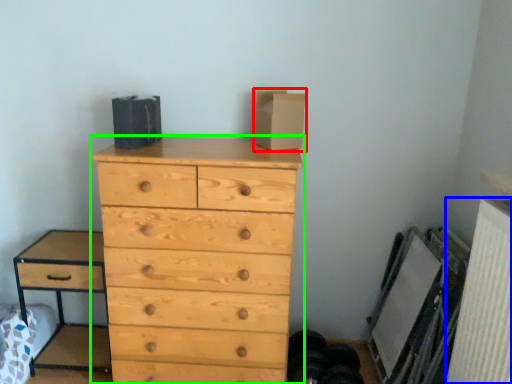
Question: Which object is the farthest from cardboard box (highlighted by a red box)? Choose among these: radiator (highlighted by a blue box) or chest of drawers (highlighted by a green box).

Choices:
 (A) radiator
 (B) chest of drawers

Answer: (A)